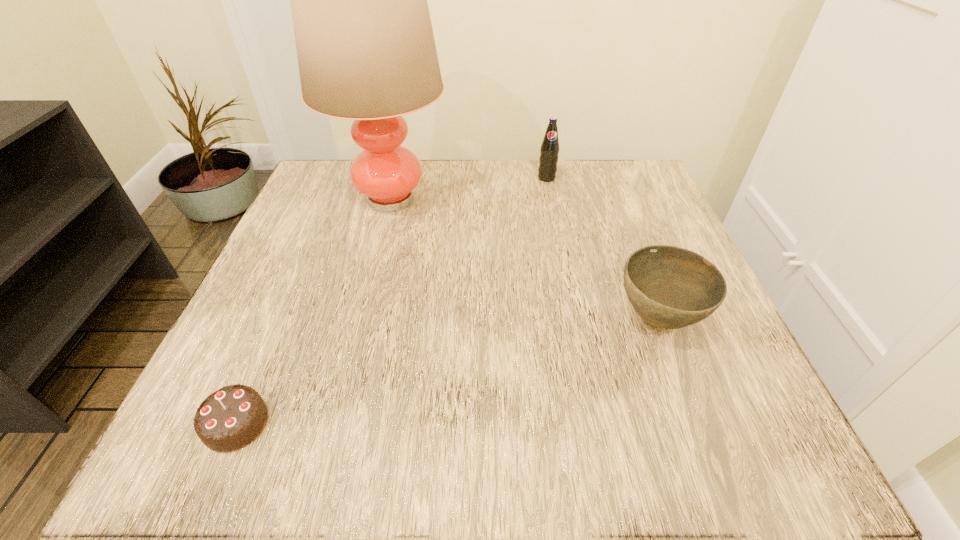
The image size is (960, 540). I want to click on free space that satisfies the following two spatial constraints: 1. on the front label of the third shortest object; 2. on the left side of the bowl, so click(575, 319).